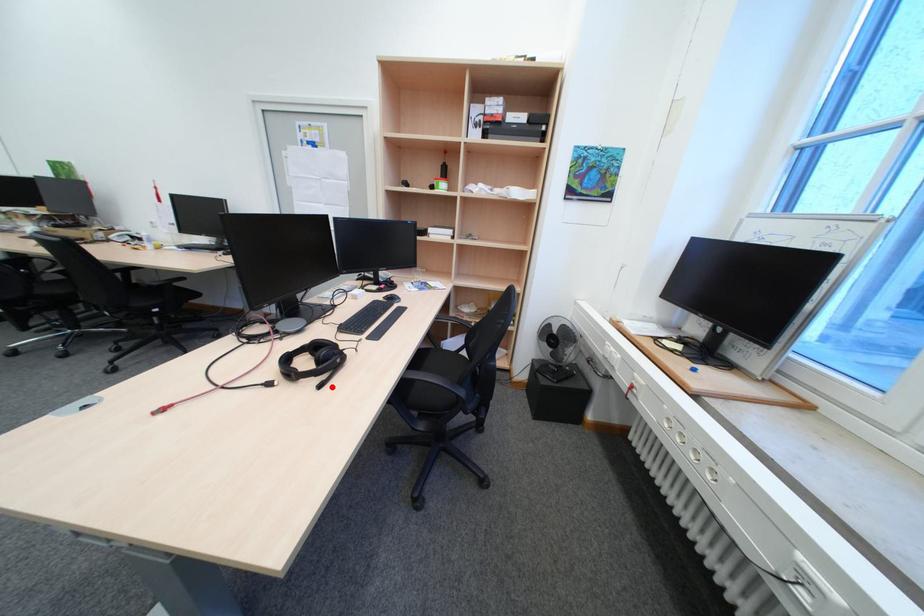
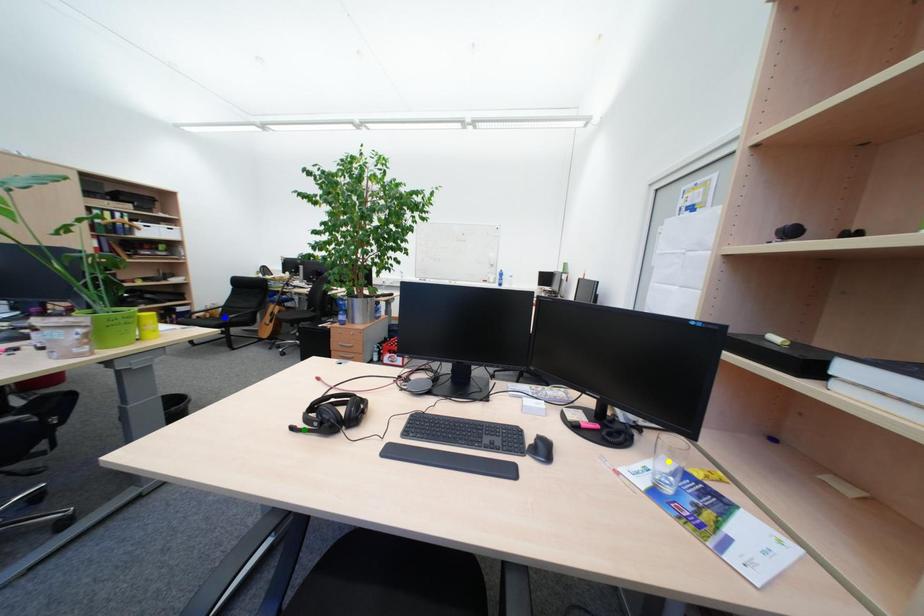
Question: I am providing you with two images of the same scene from different viewpoints. A red point is marked on the first image. You are given multiple points on the second image. Which point in image 2 is actually the same real-world point as the red point in image 1?

Choices:
 (A) yellow point
 (B) green point
 (C) blue point

Answer: (B)